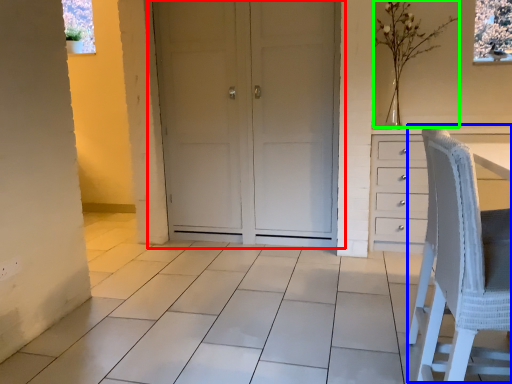
Question: Considering the real-world distances, which object is farthest from door (highlighted by a red box)? rocking chair (highlighted by a blue box) or flower (highlighted by a green box)?

Choices:
 (A) rocking chair
 (B) flower

Answer: (A)